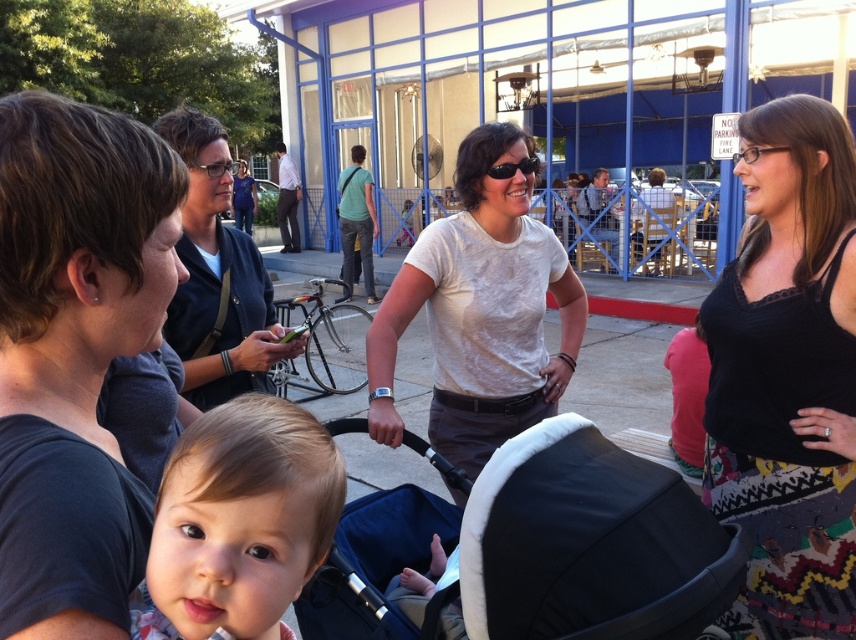
You are organizing a photo shoot and need to know which clothing item takes up more visual space in the image. Based on the scene description, which one is larger between the dark blue shirt at left and the white cotton shirt at center?

The white cotton shirt at center occupies more visual space than the dark blue shirt at left according to the description.

You are organizing a clothing display and need to arrange the dark blue shirt at left and the matte black shirt at upper right side by side. Which shirt should be placed on the wider side of the display to accommodate their sizes?

The matte black shirt at upper right should be placed on the wider side of the display because its width is greater than the dark blue shirt at left.

You are a photographer trying to capture a candid shot of both the dark blue shirt at left and the white cotton shirt at center. Since you want to ensure both subjects are in focus, which one should you focus on first based on their positions?

You should focus on the dark blue shirt at left first because it is positioned closer to the camera than the white cotton shirt at center, so adjusting focus from near to far would ensure both are in focus.